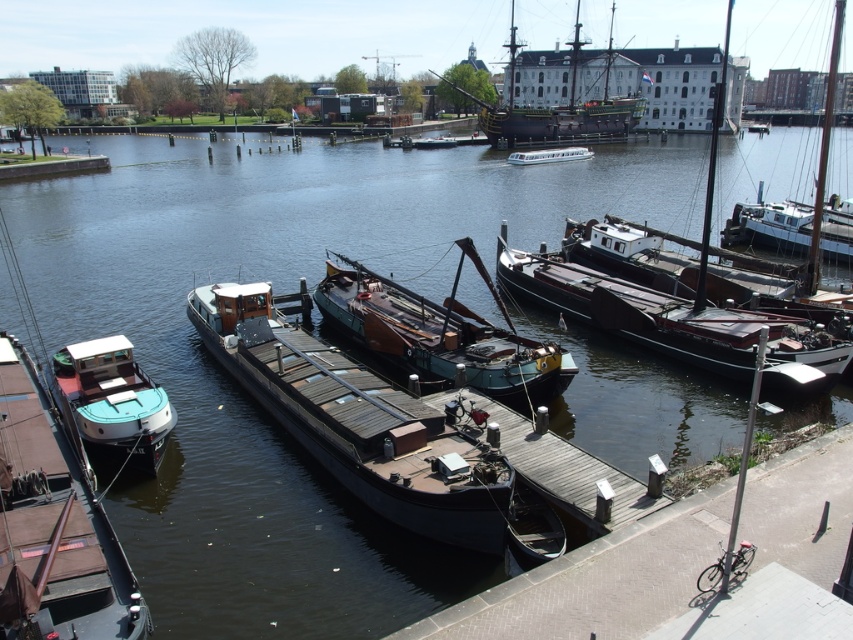
Who is lower down, wooden planks barge at center or wooden polished barge at center?

Positioned lower is wooden planks barge at center.

At what (x,y) coordinates should I click in order to perform the action: click on wooden planks barge at center. Please return your answer as a coordinate pair (x, y). Looking at the image, I should click on point(357,420).

Looking at this image, who is positioned more to the right, teal matte boat at left or white glossy boat at center?

From the viewer's perspective, white glossy boat at center appears more on the right side.

How distant is teal matte boat at left from white glossy boat at center?

teal matte boat at left is 234.16 feet from white glossy boat at center.

Where is `teal matte boat at left`? This screenshot has width=853, height=640. teal matte boat at left is located at coordinates (112, 401).

Is wooden polished barge at center bigger than white glossy boat at center?

No.

Between wooden polished barge at center and white glossy boat at center, which one appears on the right side from the viewer's perspective?

white glossy boat at center

Does point (732, 333) come in front of point (537, 148)?

Yes, it is.

Where is `wooden polished barge at center`? The height and width of the screenshot is (640, 853). wooden polished barge at center is located at coordinates (676, 323).